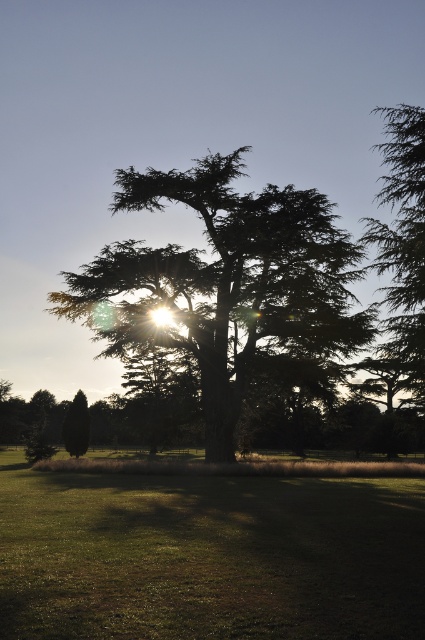
You are planning to set up a picnic blanket in the green grassy field at center. Considering the description of the green textured tree at center, will the tree provide sufficient shade for your picnic blanket?

The green textured tree at center has a thicker presence than the green grassy field at center, so it is likely to cast a larger shadow, providing sufficient shade for the picnic blanket.

You are standing at the origin point in the image. Which direction should you walk to reach the green grassy field at center?

The green grassy field at center is located at coordinates point (209, 556), so you should walk towards the right and slightly forward to reach it.